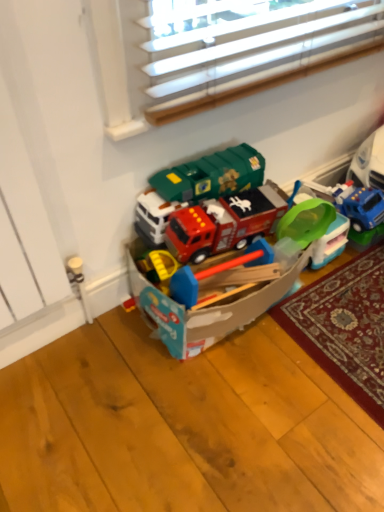
Question: Considering the positions of translucent plastic bucket at center, which is the 2th toy from left to right, and matte plastic toy box at center, which is the 1th toy in left-to-right order, in the image, is translucent plastic bucket at center, which is the 2th toy from left to right, wider or thinner than matte plastic toy box at center, which is the 1th toy in left-to-right order,?

Choices:
 (A) thin
 (B) wide

Answer: (A)

Question: Is point (304, 239) positioned closer to the camera than point (178, 211)?

Choices:
 (A) farther
 (B) closer

Answer: (A)

Question: Considering the positions of translucent plastic bucket at center, which is the 1th toy from right to left, and matte plastic toy box at center, the second toy positioned from the right, in the image, is translucent plastic bucket at center, which is the 1th toy from right to left, bigger or smaller than matte plastic toy box at center, the second toy positioned from the right,?

Choices:
 (A) big
 (B) small

Answer: (B)

Question: From a real-world perspective, is matte plastic toy box at center, which is the 1th toy in left-to-right order, positioned above or below translucent plastic bucket at center, which is the 2th toy from left to right?

Choices:
 (A) above
 (B) below

Answer: (A)

Question: Looking at their shapes, would you say matte plastic toy box at center, the second toy positioned from the right, is wider or thinner than translucent plastic bucket at center, which is the 1th toy from right to left?

Choices:
 (A) thin
 (B) wide

Answer: (B)

Question: Is matte plastic toy box at center, the second toy positioned from the right, taller or shorter than translucent plastic bucket at center, which is the 1th toy from right to left?

Choices:
 (A) short
 (B) tall

Answer: (B)

Question: Considering the relative positions of matte plastic toy box at center, which is the 1th toy in left-to-right order, and translucent plastic bucket at center, which is the 2th toy from left to right, in the image provided, is matte plastic toy box at center, which is the 1th toy in left-to-right order, to the left or to the right of translucent plastic bucket at center, which is the 2th toy from left to right,?

Choices:
 (A) right
 (B) left

Answer: (B)